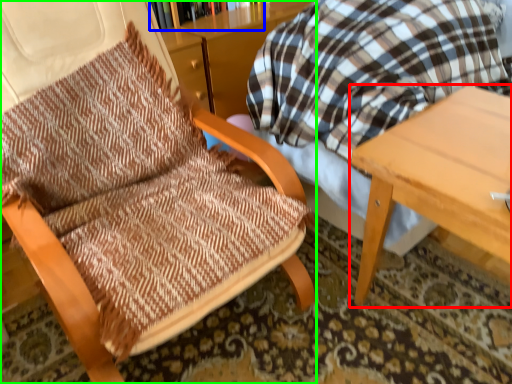
Question: Estimate the real-world distances between objects in this image. Which object is closer to table (highlighted by a red box), bookcase (highlighted by a blue box) or chair (highlighted by a green box)?

Choices:
 (A) bookcase
 (B) chair

Answer: (B)